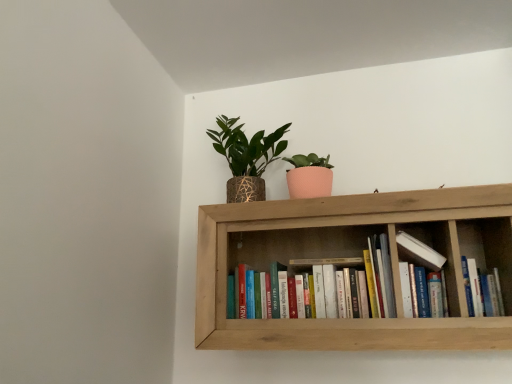
Question: Considering their positions, is textured gold pot at upper center located in front of or behind wooden bookshelf at upper center?

Choices:
 (A) front
 (B) behind

Answer: (B)

Question: Based on their positions, is textured gold pot at upper center located to the left or right of wooden bookshelf at upper center?

Choices:
 (A) left
 (B) right

Answer: (A)

Question: Which object is positioned closest to the hardcover books at center, which appears as the 1th book when viewed from the left?

Choices:
 (A) textured gold pot at upper center
 (B) wooden bookshelf at upper center
 (C) hardcover book at center, which is the 1th book in right-to-left order

Answer: (B)

Question: Considering the real-world distances, which object is closest to the hardcover books at center, the second book from the right?

Choices:
 (A) textured gold pot at upper center
 (B) hardcover book at center, positioned as the 2th book in left-to-right order
 (C) wooden bookshelf at upper center

Answer: (C)